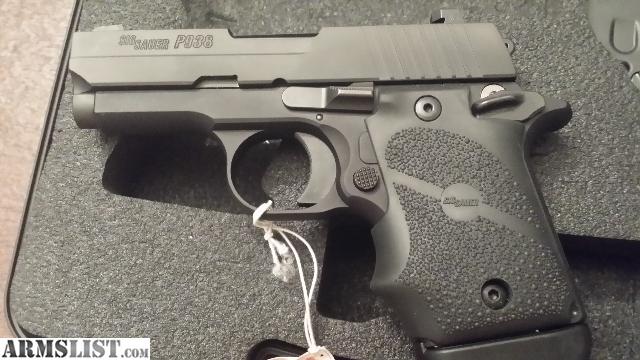
Identify the location of wall. The height and width of the screenshot is (360, 640). (31, 43).